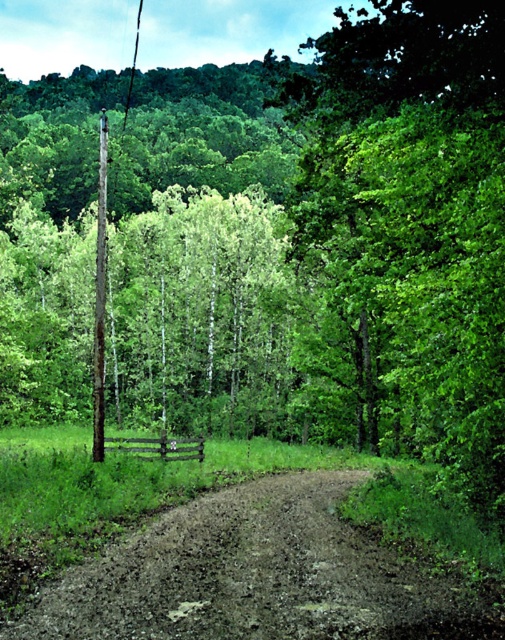
Question: Among these objects, which one is nearest to the camera?

Choices:
 (A) smooth wire at upper center
 (B) smooth brown wooden telegraph pole at left
 (C) brown dirt track at lower center

Answer: (C)

Question: Which is farther from the brown dirt track at lower center?

Choices:
 (A) brown wooden telegraph pole at left
 (B) smooth wire at upper center

Answer: (B)

Question: Can you confirm if smooth brown wooden telegraph pole at left is positioned below smooth wire at upper center?

Choices:
 (A) no
 (B) yes

Answer: (B)

Question: Can you confirm if brown wooden telegraph pole at left is positioned below smooth wire at upper center?

Choices:
 (A) yes
 (B) no

Answer: (A)

Question: Observing the image, what is the correct spatial positioning of brown dirt track at lower center in reference to smooth brown wooden telegraph pole at left?

Choices:
 (A) left
 (B) right

Answer: (B)

Question: Considering the real-world distances, which object is farthest from the smooth wire at upper center?

Choices:
 (A) brown dirt track at lower center
 (B) brown wooden telegraph pole at left
 (C) smooth brown wooden telegraph pole at left

Answer: (C)